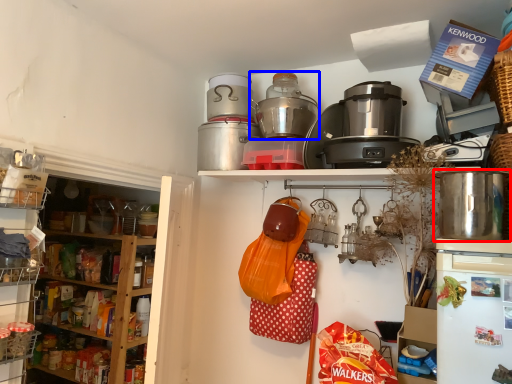
Question: Which object appears closest to the camera in this image, kitchen appliance (highlighted by a red box) or rice cooker (highlighted by a blue box)?

Choices:
 (A) kitchen appliance
 (B) rice cooker

Answer: (A)